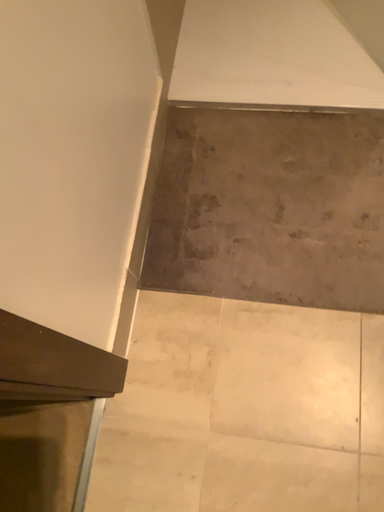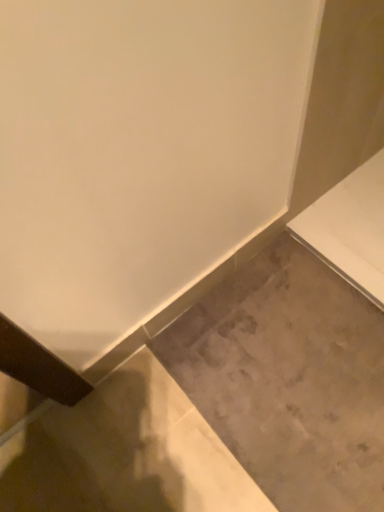
Question: Which way did the camera rotate in the video?

Choices:
 (A) rotated right
 (B) rotated left

Answer: (B)